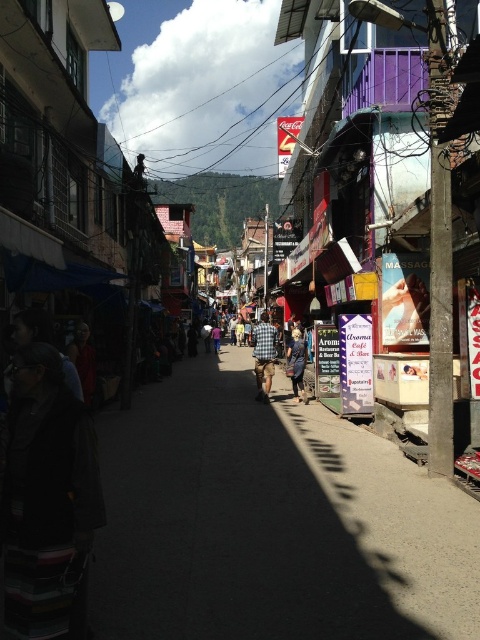
You are a delivery person trying to navigate through the narrow street. You see the concrete sidewalk at center and the checkered fabric shirt at center. Which object takes up more space in the scene?

The checkered fabric shirt at center takes up more space in the scene because the concrete sidewalk at center is smaller than it.

Consider the image. You are a delivery person with a cart that is 2 meters wide. You need to navigate through the narrow street between the checkered fabric shirt at center and the dark brown monk at center. Can your cart fit through the space between them?

The distance between the checkered fabric shirt at center and the dark brown monk at center is 5.89 meters. Since your cart is only 2 meters wide, there is more than enough space for it to pass through the gap between them.

You are a delivery person with a cart that is 2 meters wide. You need to navigate through the narrow street depicted in the scene. The cart must pass between the concrete sidewalk at center and the nearest building on the right side. Is there enough space for the cart to pass through?

The distance between the concrete sidewalk at center and the nearest building on the right side is 3.87 meters. Since the cart is only 2 meters wide, there is sufficient space for it to pass through safely.